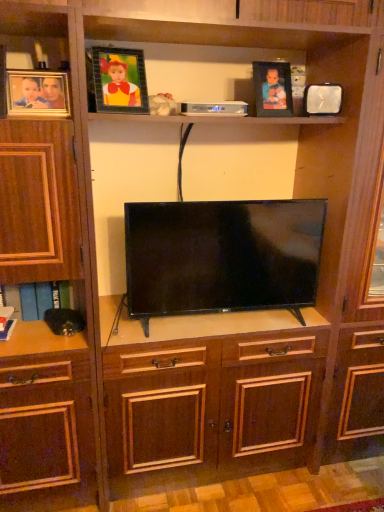
Question: Is metallic silver clock at upper right, which is counted as the fourth picture frame, starting from the left, bigger or smaller than matte wooden picture frame at upper left, which ranks as the first picture frame in left-to-right order?

Choices:
 (A) big
 (B) small

Answer: (B)

Question: Based on their positions, is metallic silver clock at upper right, the first picture frame positioned from the right, located to the left or right of matte wooden picture frame at upper left, which ranks as the first picture frame in left-to-right order?

Choices:
 (A) right
 (B) left

Answer: (A)

Question: Estimate the real-world distances between objects in this image. Which object is farther from the flat screen tv at center?

Choices:
 (A) metallic frame at upper center, the third picture frame viewed from the right
 (B) metallic silver clock at upper right, the first picture frame positioned from the right
 (C) matte black picture frame at upper center, the third picture frame positioned from the left
 (D) matte wooden picture frame at upper left, which ranks as the first picture frame in left-to-right order

Answer: (D)

Question: Which is farther from the metallic silver clock at upper right, which is counted as the fourth picture frame, starting from the left?

Choices:
 (A) metallic frame at upper center, the second picture frame positioned from the left
 (B) matte wooden picture frame at upper left, which appears as the 4th picture frame when viewed from the right
 (C) matte black picture frame at upper center, the second picture frame in the right-to-left sequence
 (D) flat screen tv at center

Answer: (B)